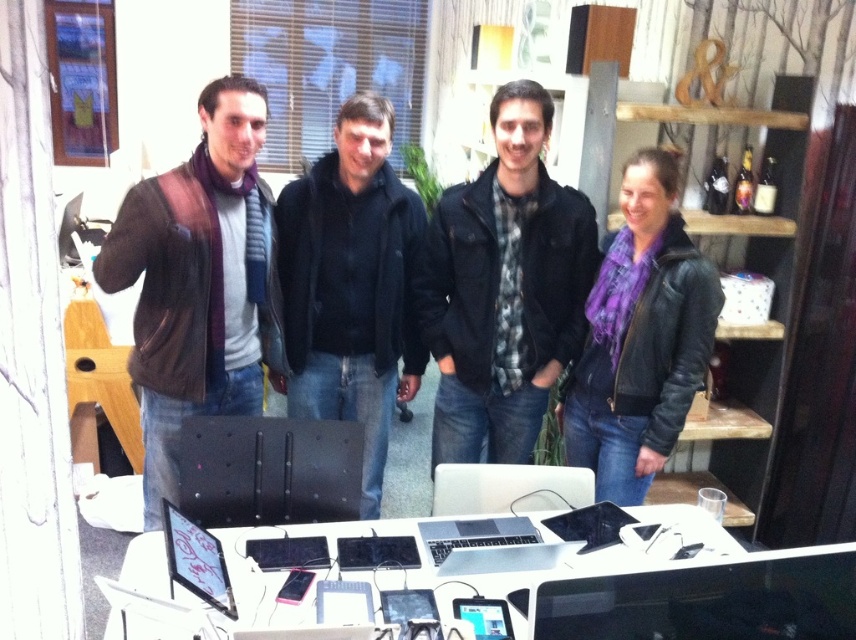
You are an office worker who needs to locate the black matte computer at center. You see the plaid fabric shirt at center in front of you. Which direction should you move to find the computer?

The plaid fabric shirt at center is to the right of the black matte computer at center, so you should move to your left to find the computer.

You are an office worker who needs to reach the matte brown leather jacket at left quickly. Where should you look first in the office space?

The matte brown leather jacket at left is located at point (197, 280), so you should look towards the left side of the image where the coordinates indicate its position.

Based on the photo, you are a delivery person who needs to place a rectangular package that measures 12 inches in length between the matte brown leather jacket at left and the black matte jacket at center. Based on the space available, can the package fit between them without bending?

The distance between the matte brown leather jacket at left and the black matte jacket at center is 11.50 inches. Since the package is 12 inches long, it cannot fit between them without bending.